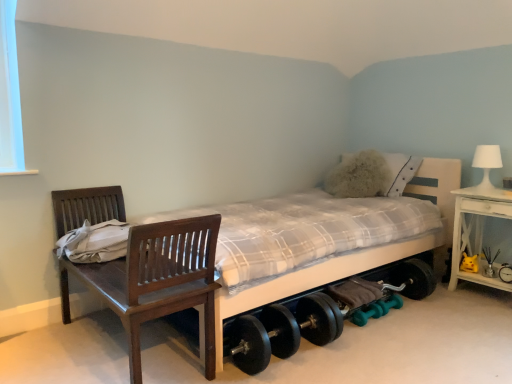
Question: From a real-world perspective, does yellow plush toy at lower right stand above white matte table lamp at upper right?

Choices:
 (A) yes
 (B) no

Answer: (B)

Question: Is yellow plush toy at lower right bigger than white matte table lamp at upper right?

Choices:
 (A) no
 (B) yes

Answer: (A)

Question: Is the position of yellow plush toy at lower right less distant than that of white matte table lamp at upper right?

Choices:
 (A) no
 (B) yes

Answer: (A)

Question: Considering the relative positions of yellow plush toy at lower right and white matte table lamp at upper right in the image provided, is yellow plush toy at lower right to the left of white matte table lamp at upper right from the viewer's perspective?

Choices:
 (A) yes
 (B) no

Answer: (A)

Question: Is yellow plush toy at lower right next to white matte table lamp at upper right and touching it?

Choices:
 (A) yes
 (B) no

Answer: (B)

Question: Is black rubber dumbbell at lower right, marked as the 3th dumbbell in a bottom-to-top arrangement, inside or outside of teal rubber dumbbell at lower center, acting as the 1th dumbbell starting from the bottom?

Choices:
 (A) inside
 (B) outside

Answer: (B)

Question: From a real-world perspective, is black rubber dumbbell at lower right, which is the 1th dumbbell from top to bottom, positioned above or below teal rubber dumbbell at lower center, which is counted as the third dumbbell, starting from the right?

Choices:
 (A) below
 (B) above

Answer: (B)

Question: In terms of height, does black rubber dumbbell at lower right, marked as the 3th dumbbell in a bottom-to-top arrangement, look taller or shorter compared to teal rubber dumbbell at lower center, the 1th dumbbell viewed from the left?

Choices:
 (A) short
 (B) tall

Answer: (B)

Question: Is point (510, 279) positioned closer to the camera than point (380, 311)?

Choices:
 (A) closer
 (B) farther

Answer: (B)

Question: Would you say white plaid fabric bed at center is to the left or to the right of wooden chair at left in the picture?

Choices:
 (A) left
 (B) right

Answer: (B)

Question: Is point (452, 162) closer or farther from the camera than point (122, 264)?

Choices:
 (A) farther
 (B) closer

Answer: (A)

Question: In terms of size, does white plaid fabric bed at center appear bigger or smaller than wooden chair at left?

Choices:
 (A) small
 (B) big

Answer: (B)

Question: Considering the positions of white plaid fabric bed at center and wooden chair at left in the image, is white plaid fabric bed at center taller or shorter than wooden chair at left?

Choices:
 (A) tall
 (B) short

Answer: (A)

Question: Looking at the image, does white matte table lamp at upper right seem bigger or smaller compared to yellow plush toy at lower right?

Choices:
 (A) small
 (B) big

Answer: (B)

Question: Considering the positions of white matte table lamp at upper right and yellow plush toy at lower right in the image, is white matte table lamp at upper right wider or thinner than yellow plush toy at lower right?

Choices:
 (A) wide
 (B) thin

Answer: (B)